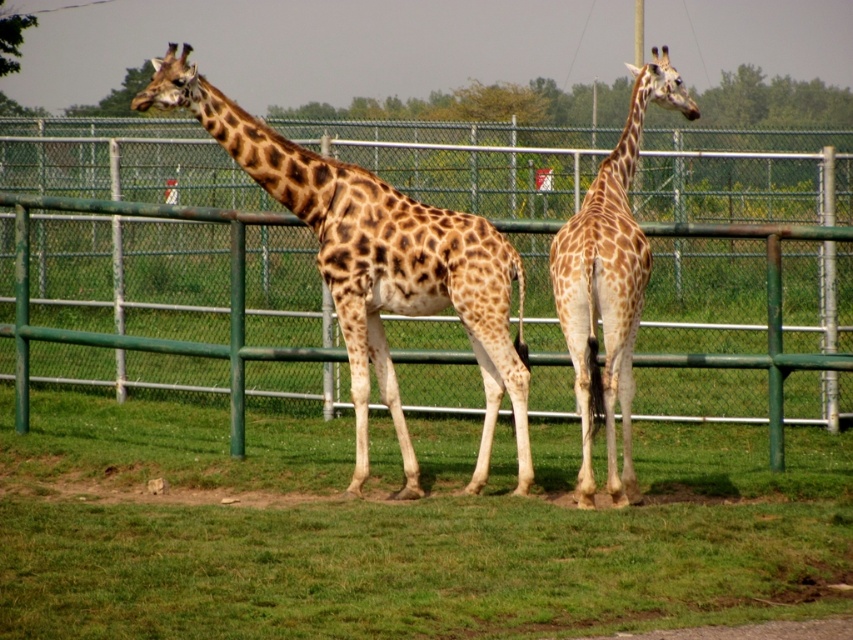
Locate an element on the screen. This screenshot has height=640, width=853. green metal fence at center is located at coordinates (158, 269).

Can you confirm if green metal fence at center is smaller than spotted fur giraffe at center?

Indeed, green metal fence at center has a smaller size compared to spotted fur giraffe at center.

Consider the image. Measure the distance between point [546,417] and camera.

They are 50.05 feet apart.

At what (x,y) coordinates should I click in order to perform the action: click on green metal fence at center. Please return your answer as a coordinate pair (x, y). Looking at the image, I should click on (158, 269).

Based on the photo, does spotted fur giraffe at left appear under spotted fur giraffe at center?

No, spotted fur giraffe at left is not below spotted fur giraffe at center.

Which is more to the right, spotted fur giraffe at left or spotted fur giraffe at center?

spotted fur giraffe at center is more to the right.

Does point (461, 292) come in front of point (610, 452)?

No, (461, 292) is further to viewer.

Where is `spotted fur giraffe at left`? The height and width of the screenshot is (640, 853). spotted fur giraffe at left is located at coordinates (376, 264).

Is green grass at lower center to the right of green metal fence at center from the viewer's perspective?

In fact, green grass at lower center is to the left of green metal fence at center.

The height and width of the screenshot is (640, 853). I want to click on green grass at lower center, so click(x=399, y=529).